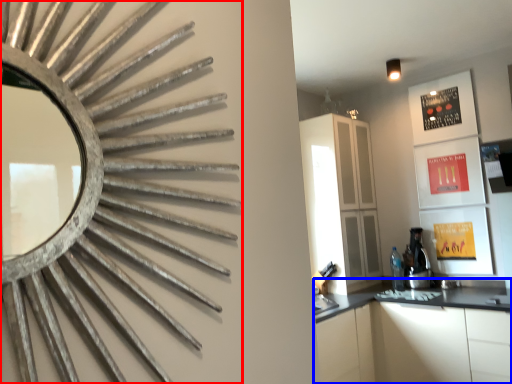
Question: Which object is closer to the camera taking this photo, mirror (highlighted by a red box) or cabinetry (highlighted by a blue box)?

Choices:
 (A) mirror
 (B) cabinetry

Answer: (A)